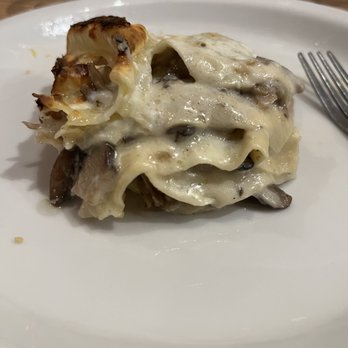
The width and height of the screenshot is (348, 348). I want to click on white plate above food, so click(x=184, y=16).